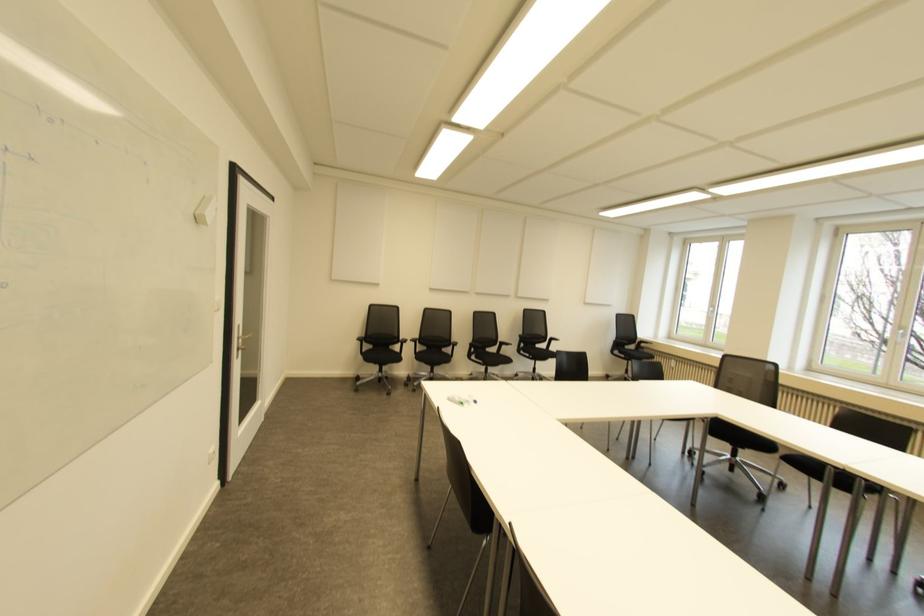
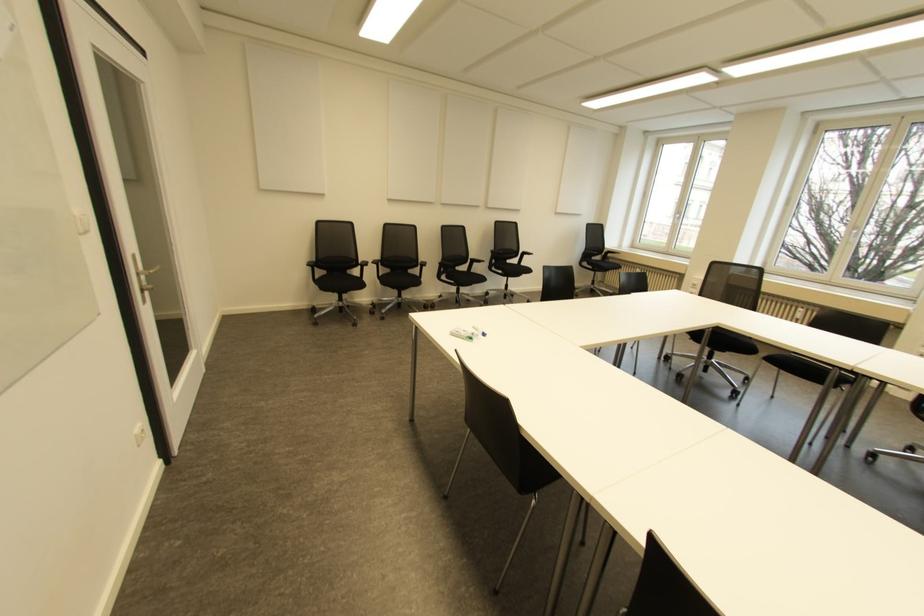
Where in the second image is the point corresponding to (x=462, y=403) from the first image?

(470, 338)